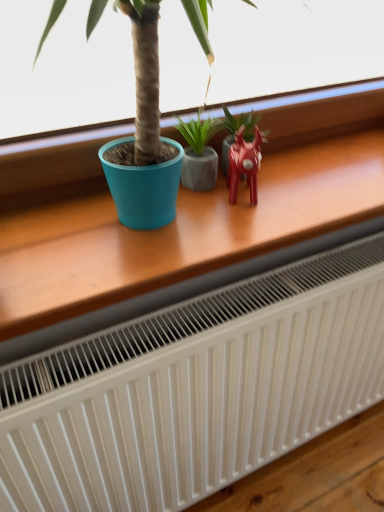
Question: In the image, is matte gray pot at center, the 2th houseplant when ordered from right to left, positioned in front of or behind wooden table at center?

Choices:
 (A) front
 (B) behind

Answer: (B)

Question: Does point (185, 160) appear closer or farther from the camera than point (382, 173)?

Choices:
 (A) closer
 (B) farther

Answer: (A)

Question: Estimate the real-world distances between objects in this image. Which object is closer to the matte gray pot at center, the 2th houseplant when ordered from right to left?

Choices:
 (A) wooden table at center
 (B) glossy ceramic plant at center, the 1th houseplant positioned from the right
 (C) glossy plastic reindeer at center right

Answer: (B)

Question: Which is farther from the matte gray pot at center, the 2th houseplant when ordered from right to left?

Choices:
 (A) glossy plastic reindeer at center right
 (B) wooden table at center
 (C) glossy ceramic plant at center, the second houseplant when ordered from left to right

Answer: (B)